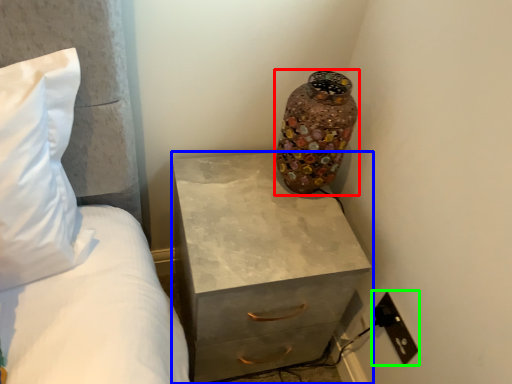
Question: Estimate the real-world distances between objects in this image. Which object is farther from vase (highlighted by a red box), chest of drawers (highlighted by a blue box) or electric outlet (highlighted by a green box)?

Choices:
 (A) chest of drawers
 (B) electric outlet

Answer: (B)